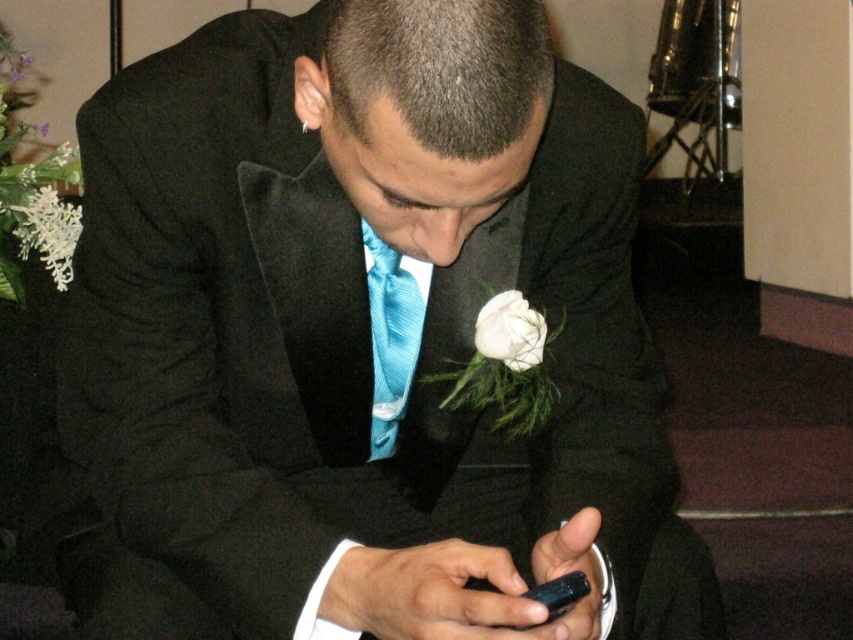
Is white fluffy flower at left to the right of white matte flower at upper left from the viewer's perspective?

Indeed, white fluffy flower at left is positioned on the right side of white matte flower at upper left.

Does white fluffy flower at left come behind white matte flower at upper left?

That is False.

Measure the distance between white fluffy flower at left and camera.

white fluffy flower at left and camera are 1.62 meters apart.

Find the location of `white fluffy flower at left`. white fluffy flower at left is located at coordinates (48, 230).

How distant is blue striped tie at center from white fluffy flower at left?

blue striped tie at center is 38.39 inches away from white fluffy flower at left.

Is blue striped tie at center taller than white fluffy flower at left?

Correct, blue striped tie at center is much taller as white fluffy flower at left.

Is point (375, 268) positioned before point (49, 257)?

Yes, point (375, 268) is in front of point (49, 257).

Identify the location of blue striped tie at center. This screenshot has width=853, height=640. (392, 337).

Between white fluffy flower at left and white silk flower at center, which one appears on the right side from the viewer's perspective?

From the viewer's perspective, white silk flower at center appears more on the right side.

Is white fluffy flower at left closer to camera compared to white silk flower at center?

No, white fluffy flower at left is further to the viewer.

Between point (65, 272) and point (498, 339), which one is positioned in front?

Point (498, 339)

This screenshot has height=640, width=853. What are the coordinates of `white fluffy flower at left` in the screenshot? It's located at (48, 230).